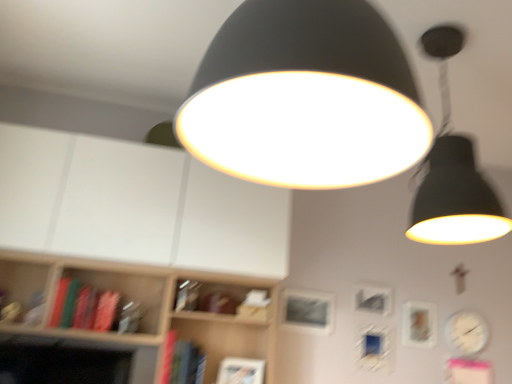
Question: Is matte silver picture frame at right, which is the third picture frame from left to right, smaller than metallic silver picture frame at center, marked as the 3th picture frame in a right-to-left arrangement?

Choices:
 (A) no
 (B) yes

Answer: (B)

Question: From a real-world perspective, is matte silver picture frame at right, positioned as the first picture frame in right-to-left order, physically above metallic silver picture frame at center, marked as the 3th picture frame in a right-to-left arrangement?

Choices:
 (A) no
 (B) yes

Answer: (A)

Question: Is matte silver picture frame at right, which is the third picture frame from left to right, bigger than metallic silver picture frame at center, marked as the 3th picture frame in a right-to-left arrangement?

Choices:
 (A) no
 (B) yes

Answer: (A)

Question: Does matte silver picture frame at right, positioned as the first picture frame in right-to-left order, have a lesser height compared to metallic silver picture frame at center, arranged as the 1th picture frame when viewed from the left?

Choices:
 (A) yes
 (B) no

Answer: (B)

Question: From the image's perspective, is matte silver picture frame at right, positioned as the first picture frame in right-to-left order, over metallic silver picture frame at center, marked as the 3th picture frame in a right-to-left arrangement?

Choices:
 (A) no
 (B) yes

Answer: (A)

Question: Is metallic silver picture frame at center, marked as the 3th picture frame in a right-to-left arrangement, inside or outside of metallic silver picture frame at center, which is counted as the 2th picture frame, starting from the right?

Choices:
 (A) inside
 (B) outside

Answer: (B)

Question: Is metallic silver picture frame at center, arranged as the 1th picture frame when viewed from the left, taller or shorter than metallic silver picture frame at center, which is counted as the 2th picture frame, starting from the left?

Choices:
 (A) short
 (B) tall

Answer: (B)

Question: From the image's perspective, is metallic silver picture frame at center, marked as the 3th picture frame in a right-to-left arrangement, located above or below metallic silver picture frame at center, which is counted as the 2th picture frame, starting from the left?

Choices:
 (A) below
 (B) above

Answer: (A)

Question: Considering the positions of point (287, 297) and point (367, 309), is point (287, 297) closer or farther from the camera than point (367, 309)?

Choices:
 (A) closer
 (B) farther

Answer: (A)

Question: From a real-world perspective, is matte silver picture frame at right, positioned as the first picture frame in right-to-left order, above or below matte black lampshade at center, which is the 1th lamp in front-to-back order?

Choices:
 (A) below
 (B) above

Answer: (A)

Question: Relative to matte black lampshade at center, the 1th lamp viewed from the left, is matte silver picture frame at right, positioned as the first picture frame in right-to-left order, in front or behind?

Choices:
 (A) front
 (B) behind

Answer: (B)

Question: Visually, is matte silver picture frame at right, positioned as the first picture frame in right-to-left order, positioned to the left or to the right of matte black lampshade at center, which is the 1th lamp in front-to-back order?

Choices:
 (A) right
 (B) left

Answer: (A)

Question: Considering the positions of matte silver picture frame at right, positioned as the first picture frame in right-to-left order, and matte black lampshade at center, which is the 1th lamp in front-to-back order, in the image, is matte silver picture frame at right, positioned as the first picture frame in right-to-left order, taller or shorter than matte black lampshade at center, which is the 1th lamp in front-to-back order,?

Choices:
 (A) short
 (B) tall

Answer: (A)

Question: In terms of height, does metallic silver picture frame at center, which is counted as the 2th picture frame, starting from the left, look taller or shorter compared to green matte book at left, which ranks as the 2th book in right-to-left order?

Choices:
 (A) tall
 (B) short

Answer: (B)

Question: Based on their sizes in the image, would you say metallic silver picture frame at center, which is counted as the 2th picture frame, starting from the right, is bigger or smaller than green matte book at left, which ranks as the 2th book in right-to-left order?

Choices:
 (A) big
 (B) small

Answer: (B)